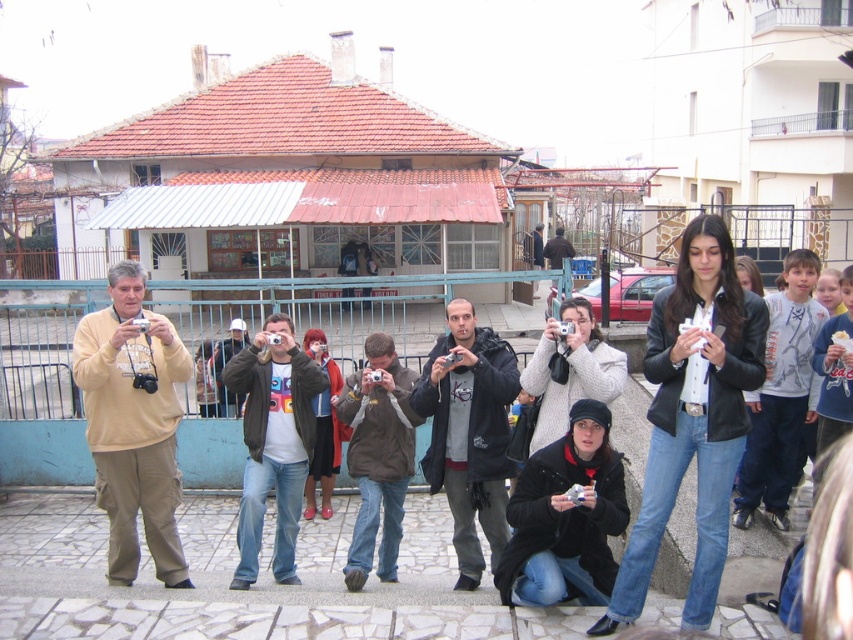
Between matte black jacket at center and dark gray jacket at center, which one has less height?

dark gray jacket at center

Is matte black jacket at center smaller than dark gray jacket at center?

No.

Between point (689, 589) and point (457, 468), which one is positioned in front?

Positioned in front is point (689, 589).

The height and width of the screenshot is (640, 853). Identify the location of matte black jacket at center. (693, 417).

Does point (91, 378) come in front of point (252, 566)?

Yes, point (91, 378) is closer to viewer.

The image size is (853, 640). Describe the element at coordinates (132, 422) in the screenshot. I see `beige fleece jacket at center` at that location.

At what (x,y) coordinates should I click in order to perform the action: click on beige fleece jacket at center. Please return your answer as a coordinate pair (x, y). The image size is (853, 640). Looking at the image, I should click on (132, 422).

Which is more to the left, matte black jacket at center or white t-shirt at center?

Positioned to the left is white t-shirt at center.

How far apart are matte black jacket at center and white t-shirt at center?

They are 3.37 meters apart.

This screenshot has height=640, width=853. What do you see at coordinates (693, 417) in the screenshot?
I see `matte black jacket at center` at bounding box center [693, 417].

The image size is (853, 640). I want to click on matte black jacket at center, so click(x=693, y=417).